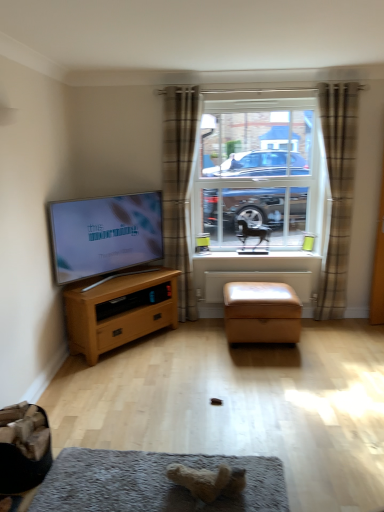
Image resolution: width=384 pixels, height=512 pixels. In order to click on vacant space underneath plaid fabric curtain at center, the first curtain viewed from the left (from a real-world perspective) in this screenshot , I will do `click(192, 318)`.